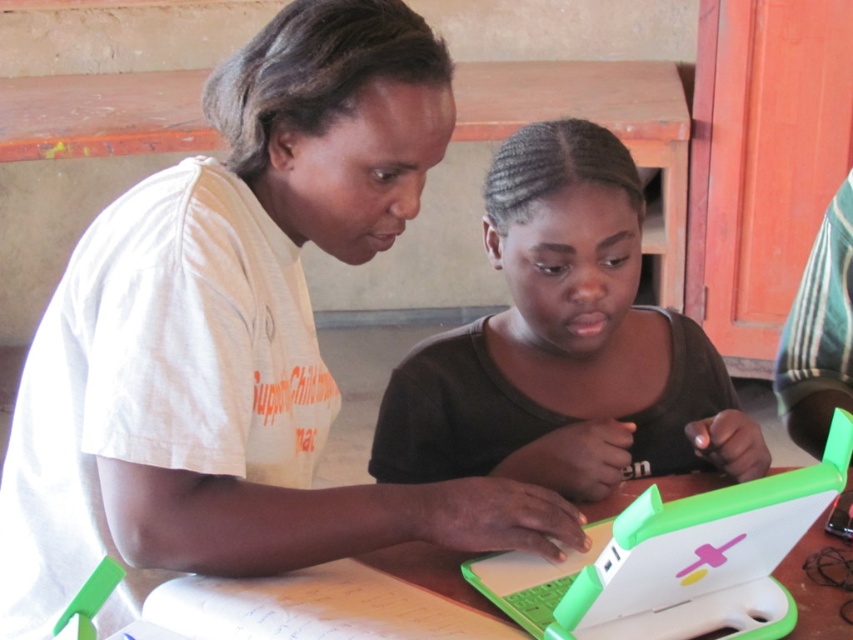
From the picture: Can you confirm if white matte shirt at upper left is positioned to the left of green plastic laptop at center?

Correct, you'll find white matte shirt at upper left to the left of green plastic laptop at center.

Is point (329, 58) more distant than point (611, 609)?

That is False.

Is point (38, 509) positioned behind point (523, 561)?

No.

Locate an element on the screen. white matte shirt at upper left is located at coordinates (236, 339).

Does point (347, 499) come behind point (650, 451)?

No, (347, 499) is in front of (650, 451).

Can you confirm if white matte shirt at upper left is shorter than matte green laptop at center?

In fact, white matte shirt at upper left may be taller than matte green laptop at center.

This screenshot has width=853, height=640. In order to click on white matte shirt at upper left in this screenshot , I will do `click(236, 339)`.

Where is `white matte shirt at upper left`? white matte shirt at upper left is located at coordinates (236, 339).

In the scene shown: Can you confirm if matte green laptop at center is positioned below green plastic laptop at center?

Actually, matte green laptop at center is above green plastic laptop at center.

Is point (520, 198) more distant than point (532, 616)?

That is True.

Identify the location of matte green laptop at center. (564, 346).